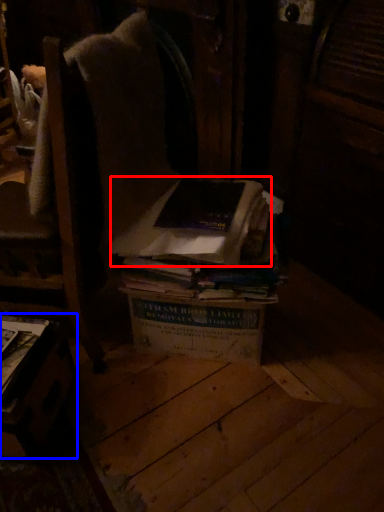
Question: Which object is closer to the camera taking this photo, book (highlighted by a red box) or table (highlighted by a blue box)?

Choices:
 (A) book
 (B) table

Answer: (B)